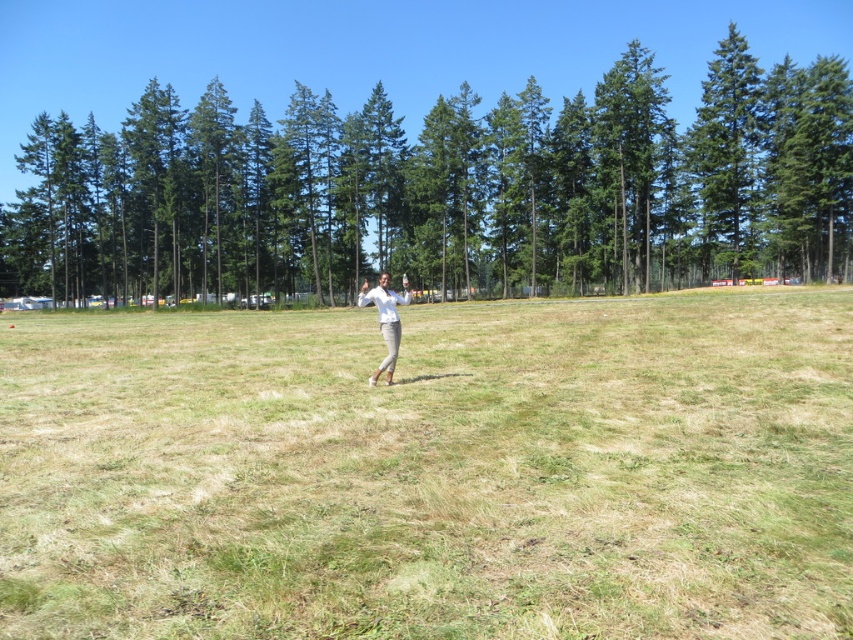
Question: Which point is closer to the camera?

Choices:
 (A) (386, 330)
 (B) (206, 236)

Answer: (A)

Question: Is green dry grass at center above green textured tree at center?

Choices:
 (A) no
 (B) yes

Answer: (A)

Question: Which of the following is the farthest from the observer?

Choices:
 (A) green textured tree at center
 (B) white matte pants at center
 (C) green dry grass at center

Answer: (A)

Question: Is green textured tree at center further to camera compared to white matte pants at center?

Choices:
 (A) no
 (B) yes

Answer: (B)

Question: Can you confirm if green dry grass at center is smaller than white matte pants at center?

Choices:
 (A) yes
 (B) no

Answer: (B)

Question: Which point is farther to the camera?

Choices:
 (A) (331, 182)
 (B) (387, 298)
 (C) (161, 586)

Answer: (A)